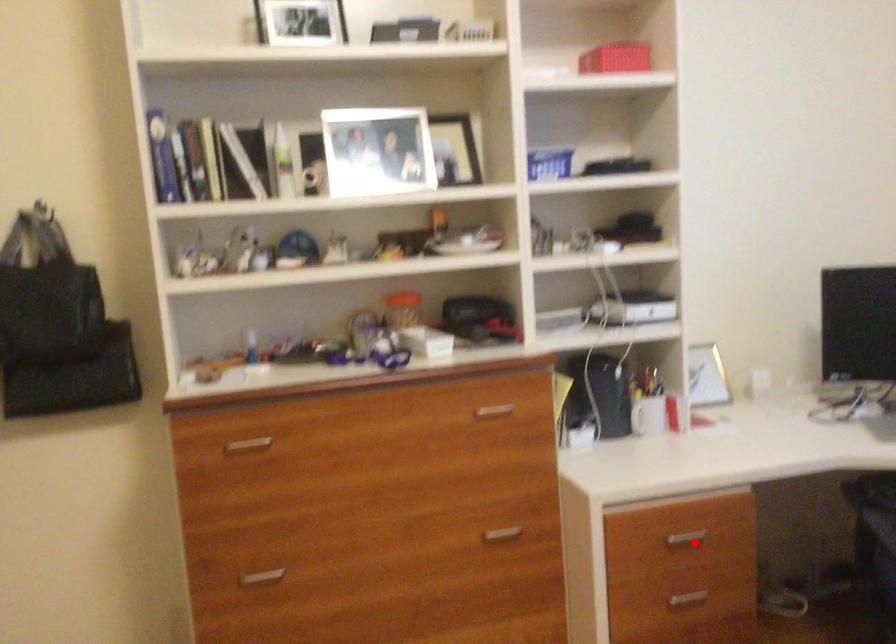
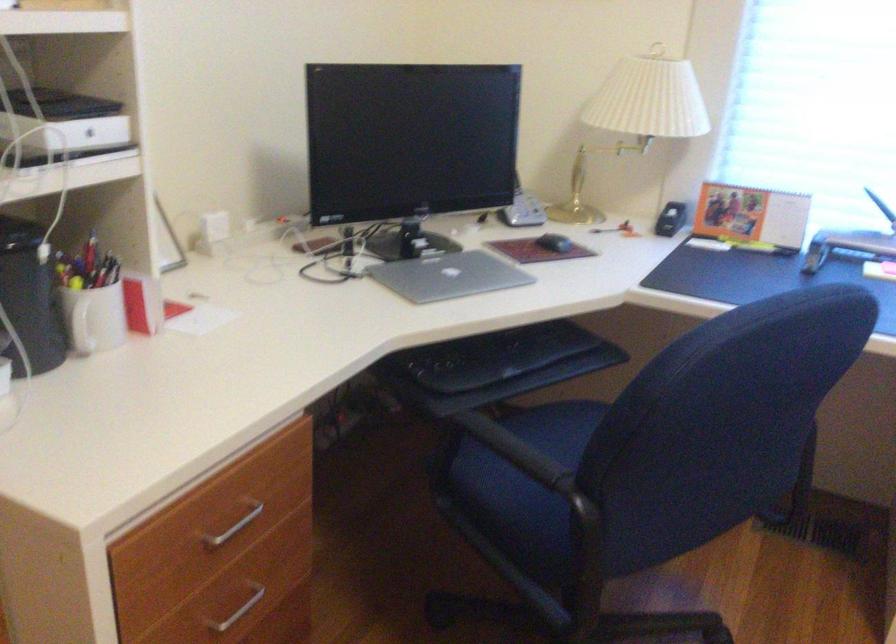
Question: I am providing you with two images of the same scene from different viewpoints. Given a red point in image1, look at the same physical point in image2. Is it:

Choices:
 (A) Closer to the viewpoint
 (B) Farther from the viewpoint

Answer: (A)